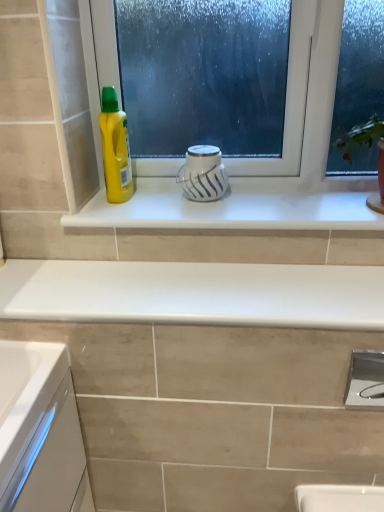
Identify the location of satin nickel faucet at lower right. (365, 380).

At what (x,y) coordinates should I click in order to perform the action: click on white glossy window sill at center. Please return your answer as a coordinate pair (x, y). Looking at the image, I should click on (238, 206).

Where is `white glossy mug at center`? The width and height of the screenshot is (384, 512). white glossy mug at center is located at coordinates (203, 173).

From the picture: Is white glossy mug at center oriented away from white glossy countertop at center?

No, white glossy mug at center's orientation is not away from white glossy countertop at center.

From the picture: Can you confirm if white glossy mug at center is wider than white glossy countertop at center?

In fact, white glossy mug at center might be narrower than white glossy countertop at center.

Is white glossy mug at center smaller than white glossy countertop at center?

Indeed, white glossy mug at center has a smaller size compared to white glossy countertop at center.

Is satin nickel faucet at lower right at the right side of white glossy countertop at center?

Yes, satin nickel faucet at lower right is to the right of white glossy countertop at center.

Considering the relative sizes of satin nickel faucet at lower right and white glossy countertop at center in the image provided, is satin nickel faucet at lower right bigger than white glossy countertop at center?

No.

Can you see satin nickel faucet at lower right touching white glossy countertop at center?

No, satin nickel faucet at lower right is not beside white glossy countertop at center.

Can you tell me how much yellow plastic bottle at left and white glossy mug at center differ in facing direction?

There is a 0.651-degree angle between the facing directions of yellow plastic bottle at left and white glossy mug at center.

Is yellow plastic bottle at left not close to white glossy mug at center?

No, yellow plastic bottle at left is not far from white glossy mug at center.

Is the depth of yellow plastic bottle at left less than that of white glossy mug at center?

That is True.

From the image's perspective, is yellow plastic bottle at left above white glossy mug at center?

Correct, yellow plastic bottle at left appears higher than white glossy mug at center in the image.

Which is more to the right, satin nickel faucet at lower right or yellow plastic bottle at left?

From the viewer's perspective, satin nickel faucet at lower right appears more on the right side.

Locate an element on the screen. The height and width of the screenshot is (512, 384). faucet that is below the yellow plastic bottle at left (from the image's perspective) is located at coordinates (365, 380).

From a real-world perspective, is satin nickel faucet at lower right positioned under yellow plastic bottle at left based on gravity?

Indeed, from a real-world perspective, satin nickel faucet at lower right is positioned beneath yellow plastic bottle at left.

Which object is thinner, satin nickel faucet at lower right or yellow plastic bottle at left?

satin nickel faucet at lower right.

From a real-world perspective, is white glossy countertop at center on satin nickel faucet at lower right?

Indeed, from a real-world perspective, white glossy countertop at center stands above satin nickel faucet at lower right.

Is white glossy countertop at center not near satin nickel faucet at lower right?

No, there isn't a large distance between white glossy countertop at center and satin nickel faucet at lower right.

Which of these two, white glossy countertop at center or satin nickel faucet at lower right, is wider?

white glossy countertop at center.

Locate an element on the screen. The height and width of the screenshot is (512, 384). faucet to the right of white glossy mug at center is located at coordinates (365, 380).

Would you say satin nickel faucet at lower right is outside white glossy mug at center?

Yes, satin nickel faucet at lower right is not within white glossy mug at center.

Is point (381, 398) less distant than point (220, 167)?

Yes.

From the picture: Measure the distance from satin nickel faucet at lower right to white glossy mug at center.

satin nickel faucet at lower right and white glossy mug at center are 22.22 inches apart.

Based on the photo, is white glossy countertop at center closer to the viewer compared to white glossy mug at center?

Yes, white glossy countertop at center is in front of white glossy mug at center.

This screenshot has width=384, height=512. I want to click on countertop that appears in front of the white glossy mug at center, so click(x=194, y=293).

From the image's perspective, is white glossy countertop at center over white glossy mug at center?

Actually, white glossy countertop at center appears below white glossy mug at center in the image.

Between white glossy countertop at center and white glossy mug at center, which one has larger size?

white glossy countertop at center.

Locate an element on the screen. The height and width of the screenshot is (512, 384). appliance on the right of white glossy countertop at center is located at coordinates (203, 173).

Image resolution: width=384 pixels, height=512 pixels. I want to click on faucet below the white glossy countertop at center (from the image's perspective), so pos(365,380).

Estimate the real-world distances between objects in this image. Which object is further from white glossy countertop at center, yellow plastic bottle at left or satin nickel faucet at lower right?

Based on the image, yellow plastic bottle at left appears to be further to white glossy countertop at center.

Estimate the real-world distances between objects in this image. Which object is further from white glossy countertop at center, white glossy mug at center or yellow plastic bottle at left?

yellow plastic bottle at left lies further to white glossy countertop at center than the other object.

Looking at the image, which one is located further to satin nickel faucet at lower right, white glossy window sill at center or white glossy countertop at center?

white glossy window sill at center is positioned further to the anchor satin nickel faucet at lower right.

Estimate the real-world distances between objects in this image. Which object is closer to satin nickel faucet at lower right, white glossy mug at center or yellow plastic bottle at left?

Based on the image, white glossy mug at center appears to be nearer to satin nickel faucet at lower right.

Based on their spatial positions, is yellow plastic bottle at left or satin nickel faucet at lower right further from white glossy window sill at center?

satin nickel faucet at lower right lies further to white glossy window sill at center than the other object.

Considering their positions, is white glossy countertop at center positioned closer to satin nickel faucet at lower right than white glossy window sill at center?

white glossy countertop at center is positioned closer to the anchor satin nickel faucet at lower right.

From the image, which object appears to be nearer to yellow plastic bottle at left, satin nickel faucet at lower right or white glossy countertop at center?

white glossy countertop at center lies closer to yellow plastic bottle at left than the other object.

When comparing their distances from white glossy window sill at center, does yellow plastic bottle at left or white glossy mug at center seem further?

Based on the image, yellow plastic bottle at left appears to be further to white glossy window sill at center.

You are a GUI agent. You are given a task and a screenshot of the screen. Output one action in this format:
    pyautogui.click(x=<x>, y=<y>)
    Task: Click on the appliance located between yellow plastic bottle at left and satin nickel faucet at lower right in the left-right direction
    Image resolution: width=384 pixels, height=512 pixels.
    Given the screenshot: What is the action you would take?
    pyautogui.click(x=203, y=173)

Image resolution: width=384 pixels, height=512 pixels. Find the location of `countertop between yellow plastic bottle at left and satin nickel faucet at lower right`. countertop between yellow plastic bottle at left and satin nickel faucet at lower right is located at coordinates (194, 293).

Where is `window sill between white glossy mug at center and satin nickel faucet at lower right in the vertical direction`? window sill between white glossy mug at center and satin nickel faucet at lower right in the vertical direction is located at coordinates (238, 206).

This screenshot has height=512, width=384. I want to click on window sill between white glossy countertop at center and satin nickel faucet at lower right from left to right, so click(238, 206).